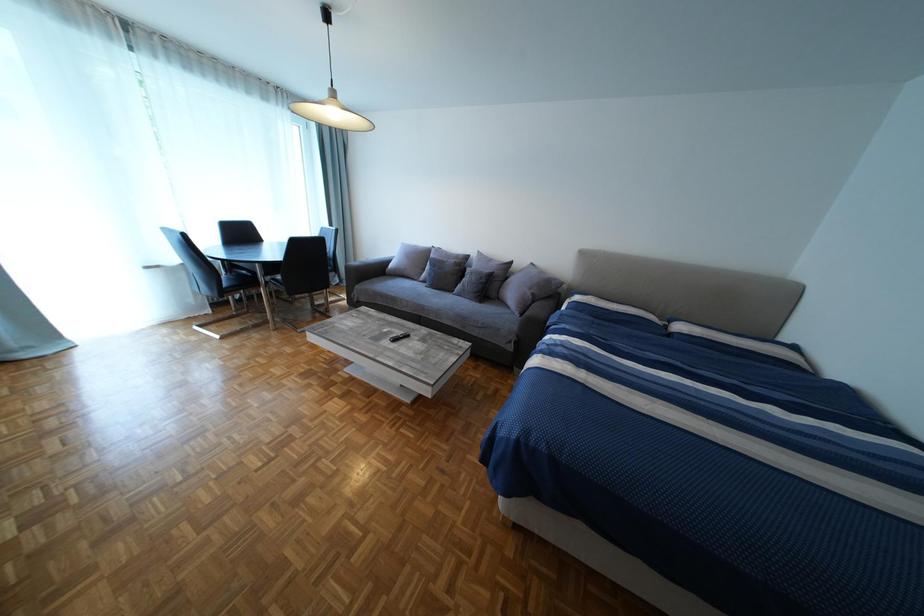
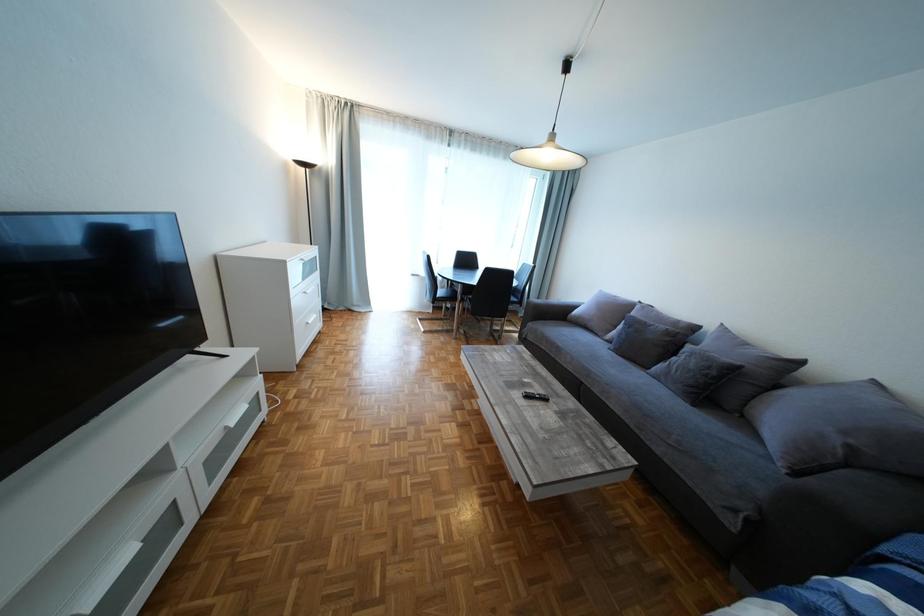
Question: Based on the continuous images, in which direction is the camera rotating? Reply with the corresponding letter.

Choices:
 (A) Left
 (B) Right
 (C) Up
 (D) Down

Answer: (A)